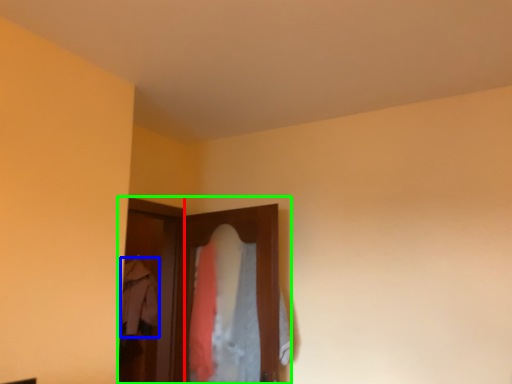
Question: Which object is positioned farthest from screen door (highlighted by a red box)? Select from clothing (highlighted by a blue box) and closet (highlighted by a green box).

Choices:
 (A) clothing
 (B) closet

Answer: (B)